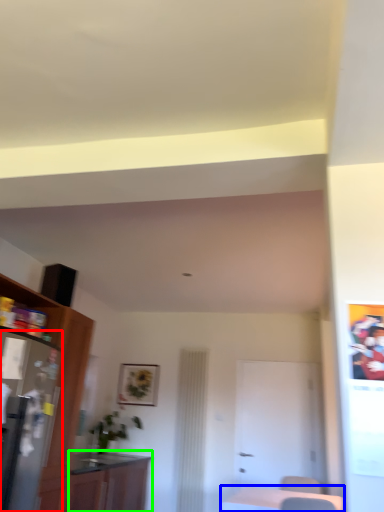
Question: Which object is the closest to the appliance (highlighted by a red box)? Choose among these: table (highlighted by a blue box) or cabinetry (highlighted by a green box).

Choices:
 (A) table
 (B) cabinetry

Answer: (B)